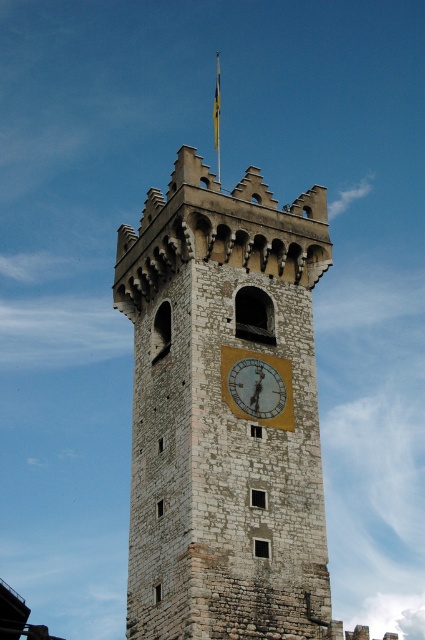
In the scene shown: Does stone clock tower at center have a smaller size compared to yellow fabric flag at top?

No.

Does stone clock tower at center appear over yellow fabric flag at top?

Incorrect, stone clock tower at center is not positioned above yellow fabric flag at top.

Between point (306, 600) and point (218, 124), which one is positioned in front?

Positioned in front is point (306, 600).

The image size is (425, 640). I want to click on stone clock tower at center, so click(x=223, y=412).

Between point (169, 456) and point (268, 374), which one is positioned in front?

Point (169, 456)

Between stone clock tower at center and gold metallic clock at center, which one has more height?

Standing taller between the two is stone clock tower at center.

Which is behind, point (201, 385) or point (235, 396)?

Point (235, 396)

Where is `stone clock tower at center`? The image size is (425, 640). stone clock tower at center is located at coordinates (223, 412).

Can you confirm if gold metallic clock at center is bigger than yellow fabric flag at top?

No, gold metallic clock at center is not bigger than yellow fabric flag at top.

Based on the photo, does gold metallic clock at center have a lesser height compared to yellow fabric flag at top?

Yes.

Between point (260, 396) and point (218, 120), which one is positioned in front?

Point (260, 396)

The height and width of the screenshot is (640, 425). Find the location of `gold metallic clock at center`. gold metallic clock at center is located at coordinates (257, 387).